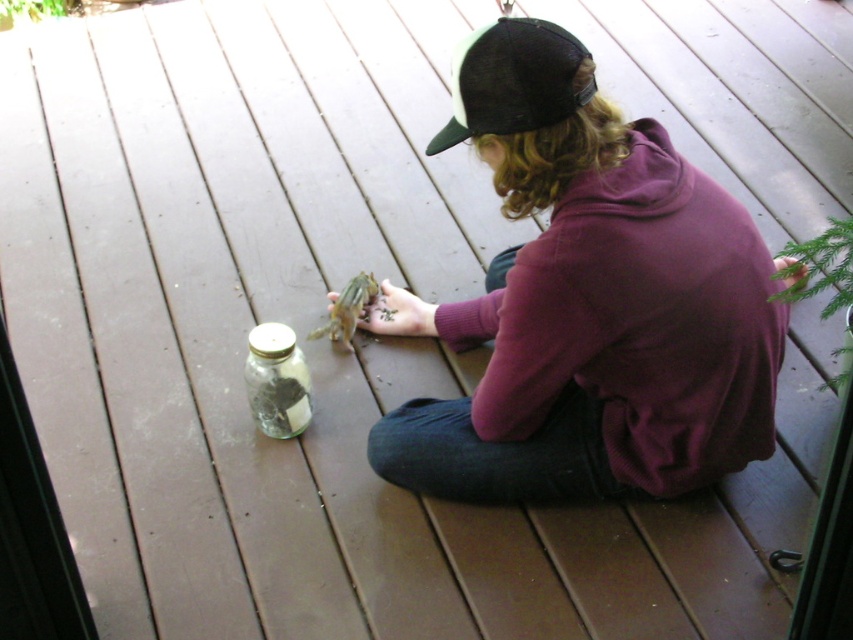
Can you confirm if purple fleece sweatshirt at center is wider than clear glass jar at center?

Yes.

Does purple fleece sweatshirt at center have a lesser width compared to clear glass jar at center?

Incorrect, purple fleece sweatshirt at center's width is not less than clear glass jar at center's.

Who is more distant from viewer, (505, 20) or (248, 403)?

The point (248, 403) is behind.

Where is `purple fleece sweatshirt at center`? This screenshot has height=640, width=853. purple fleece sweatshirt at center is located at coordinates (589, 304).

Who is lower down, black leather cap at upper center or clear glass jar at center?

clear glass jar at center is below.

Is point (593, 76) more distant than point (303, 406)?

No, it is in front of (303, 406).

Locate an element on the screen. black leather cap at upper center is located at coordinates (514, 81).

Can you confirm if purple fleece sweatshirt at center is positioned to the left of green matte chipmunk at center?

No, purple fleece sweatshirt at center is not to the left of green matte chipmunk at center.

Find the location of a particular element. The width and height of the screenshot is (853, 640). purple fleece sweatshirt at center is located at coordinates 589,304.